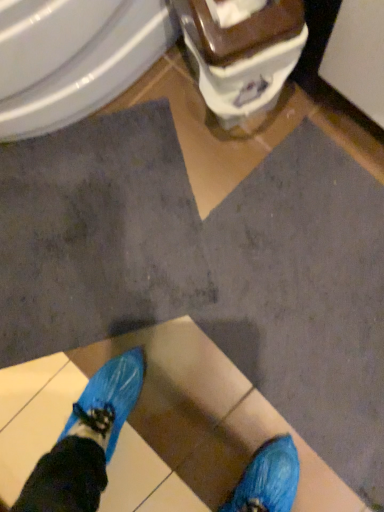
Measure the distance between point (203, 51) and camera.

Point (203, 51) and camera are 73.00 centimeters apart from each other.

At what (x,y) coordinates should I click in order to perform the action: click on brown glossy toilet at upper center. Please return your answer as a coordinate pair (x, y). Image resolution: width=384 pixels, height=512 pixels. Looking at the image, I should click on (242, 52).

Describe the element at coordinates (242, 52) in the screenshot. This screenshot has height=512, width=384. I see `brown glossy toilet at upper center` at that location.

Where is `white glossy bidet at upper left`? The width and height of the screenshot is (384, 512). white glossy bidet at upper left is located at coordinates (73, 57).

Measure the distance between point (x=1, y=123) and camera.

Point (x=1, y=123) and camera are 93.20 centimeters apart from each other.

Describe the element at coordinates (73, 57) in the screenshot. This screenshot has width=384, height=512. I see `white glossy bidet at upper left` at that location.

Identify the location of brown glossy toilet at upper center. The width and height of the screenshot is (384, 512). (242, 52).

Which is more to the left, white glossy bidet at upper left or brown glossy toilet at upper center?

white glossy bidet at upper left is more to the left.

Between white glossy bidet at upper left and brown glossy toilet at upper center, which one is positioned behind?

white glossy bidet at upper left is further from the camera.

Does point (172, 40) lie behind point (199, 58)?

Yes, it is.

From the image's perspective, is white glossy bidet at upper left above or below brown glossy toilet at upper center?

Clearly, from the image's perspective, white glossy bidet at upper left is above brown glossy toilet at upper center.

From a real-world perspective, is white glossy bidet at upper left positioned above or below brown glossy toilet at upper center?

white glossy bidet at upper left is situated higher than brown glossy toilet at upper center in the real world.

Looking at their sizes, would you say white glossy bidet at upper left is wider or thinner than brown glossy toilet at upper center?

Considering their sizes, white glossy bidet at upper left looks broader than brown glossy toilet at upper center.

Considering the relative sizes of white glossy bidet at upper left and brown glossy toilet at upper center in the image provided, is white glossy bidet at upper left taller than brown glossy toilet at upper center?

Yes, white glossy bidet at upper left is taller than brown glossy toilet at upper center.

Can you confirm if white glossy bidet at upper left is bigger than brown glossy toilet at upper center?

Indeed, white glossy bidet at upper left has a larger size compared to brown glossy toilet at upper center.

Is white glossy bidet at upper left inside the boundaries of brown glossy toilet at upper center, or outside?

white glossy bidet at upper left is spatially situated outside brown glossy toilet at upper center.

Would you consider white glossy bidet at upper left to be distant from brown glossy toilet at upper center?

white glossy bidet at upper left is near brown glossy toilet at upper center, not far away.

Is white glossy bidet at upper left facing towards brown glossy toilet at upper center?

Yes, white glossy bidet at upper left is oriented towards brown glossy toilet at upper center.

Can you tell me how much white glossy bidet at upper left and brown glossy toilet at upper center differ in facing direction?

white glossy bidet at upper left and brown glossy toilet at upper center are facing 109 degrees away from each other.

How far apart are white glossy bidet at upper left and brown glossy toilet at upper center?

A distance of 9.86 inches exists between white glossy bidet at upper left and brown glossy toilet at upper center.

The width and height of the screenshot is (384, 512). Find the location of `toilet below the white glossy bidet at upper left (from the image's perspective)`. toilet below the white glossy bidet at upper left (from the image's perspective) is located at coordinates (242, 52).

Visually, is brown glossy toilet at upper center positioned to the left or to the right of white glossy bidet at upper left?

Based on their positions, brown glossy toilet at upper center is located to the right of white glossy bidet at upper left.

Considering their positions, is brown glossy toilet at upper center located in front of or behind white glossy bidet at upper left?

brown glossy toilet at upper center is positioned closer to the viewer than white glossy bidet at upper left.

Considering the points (250, 83) and (87, 72), which point is behind, point (250, 83) or point (87, 72)?

The point (87, 72) is farther.

From the image's perspective, between brown glossy toilet at upper center and white glossy bidet at upper left, who is located below?

From the image's view, brown glossy toilet at upper center is below.

From a real-world perspective, between brown glossy toilet at upper center and white glossy bidet at upper left, who is vertically lower?

From a 3D spatial view, brown glossy toilet at upper center is below.

Considering the sizes of objects brown glossy toilet at upper center and white glossy bidet at upper left in the image provided, who is wider, brown glossy toilet at upper center or white glossy bidet at upper left?

white glossy bidet at upper left is wider.

Who is taller, brown glossy toilet at upper center or white glossy bidet at upper left?

Standing taller between the two is white glossy bidet at upper left.

Can you confirm if brown glossy toilet at upper center is smaller than white glossy bidet at upper left?

Yes, brown glossy toilet at upper center is smaller than white glossy bidet at upper left.

Can we say brown glossy toilet at upper center lies outside white glossy bidet at upper left?

That's correct, brown glossy toilet at upper center is outside of white glossy bidet at upper left.

Would you consider brown glossy toilet at upper center to be distant from white glossy bidet at upper left?

No, brown glossy toilet at upper center is not far from white glossy bidet at upper left.

Is brown glossy toilet at upper center oriented towards white glossy bidet at upper left?

Yes, brown glossy toilet at upper center faces towards white glossy bidet at upper left.

What's the angular difference between brown glossy toilet at upper center and white glossy bidet at upper left's facing directions?

They differ by 109 degrees in their facing directions.

Where is `toilet below the white glossy bidet at upper left (from the image's perspective)`? The image size is (384, 512). toilet below the white glossy bidet at upper left (from the image's perspective) is located at coordinates (242, 52).

Where is `bidet on the left of the brown glossy toilet at upper center`? This screenshot has height=512, width=384. bidet on the left of the brown glossy toilet at upper center is located at coordinates (73, 57).

Locate an element on the screen. This screenshot has width=384, height=512. toilet below the white glossy bidet at upper left (from the image's perspective) is located at coordinates (242, 52).